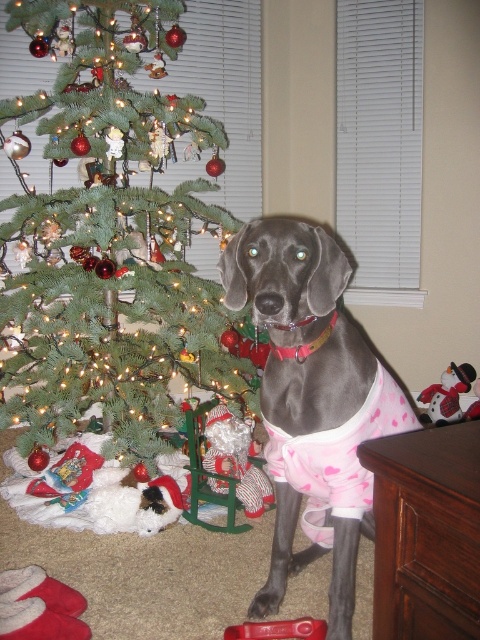
This screenshot has width=480, height=640. Describe the element at coordinates (112, 237) in the screenshot. I see `green matte christmas tree at center` at that location.

Does green matte christmas tree at center have a greater height compared to shiny gray dog at center?

Indeed, green matte christmas tree at center has a greater height compared to shiny gray dog at center.

This screenshot has width=480, height=640. Describe the element at coordinates (112, 237) in the screenshot. I see `green matte christmas tree at center` at that location.

Identify the location of green matte christmas tree at center. This screenshot has width=480, height=640. (112, 237).